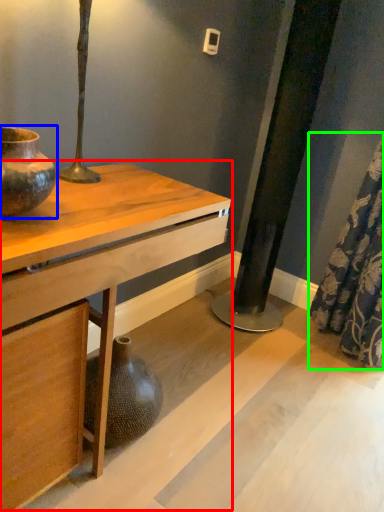
Question: Which object is positioned closest to table (highlighted by a red box)? Select from vase (highlighted by a blue box) and shower curtain (highlighted by a green box).

Choices:
 (A) vase
 (B) shower curtain

Answer: (A)